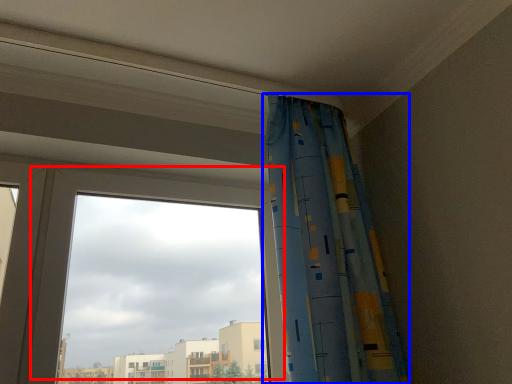
Question: Which point is further to the camera, window (highlighted by a red box) or curtain (highlighted by a blue box)?

Choices:
 (A) window
 (B) curtain

Answer: (A)